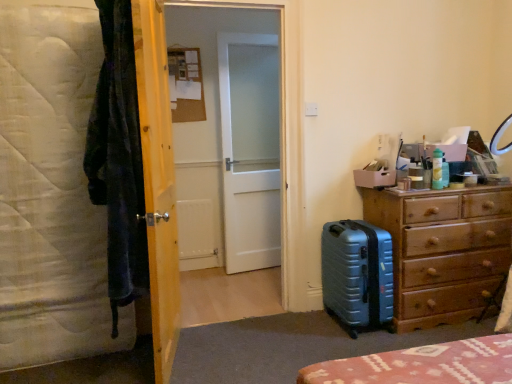
Where is `free space that is in between wooden door at center and metallic blue suitcase at lower right`? This screenshot has height=384, width=512. free space that is in between wooden door at center and metallic blue suitcase at lower right is located at coordinates (262, 339).